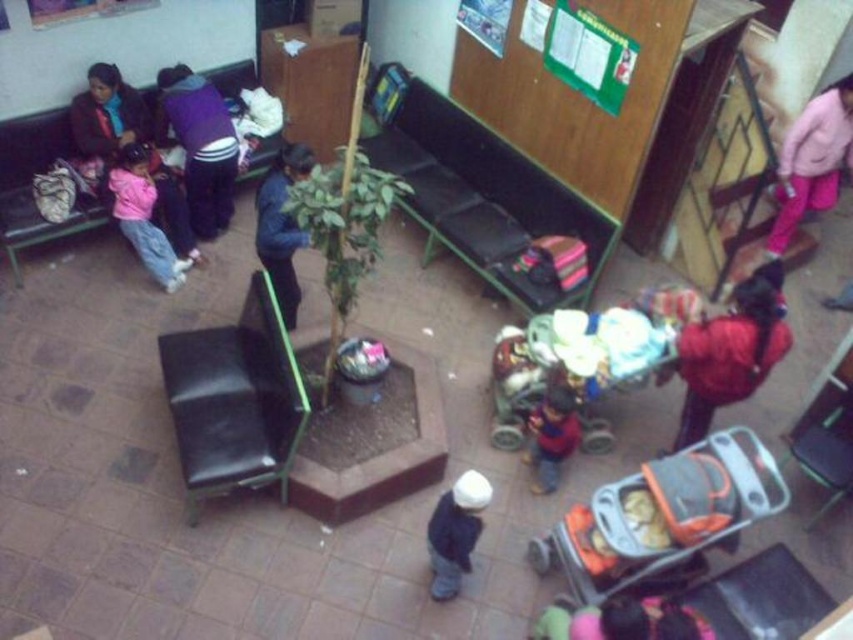
Question: Considering the real-world distances, which object is farthest from the pink fleece jacket at upper right?

Choices:
 (A) dark blue denim jacket at center
 (B) purple fleece jacket at upper left
 (C) fluffy pink blanket at lower center

Answer: (B)

Question: Based on their relative distances, which object is farther from the fluffy pink blanket at lower center?

Choices:
 (A) matte purple sweater at upper left
 (B) purple fleece jacket at upper left
 (C) blue fabric jacket at center

Answer: (A)

Question: Can you confirm if purple fleece jacket at upper left is thinner than fluffy pink blanket at lower center?

Choices:
 (A) no
 (B) yes

Answer: (B)

Question: Which object is farther from the camera taking this photo?

Choices:
 (A) pink fleece jacket at upper left
 (B) green fabric bench at center

Answer: (B)

Question: Is the position of matte purple sweater at upper left more distant than that of fluffy pink blanket at lower center?

Choices:
 (A) yes
 (B) no

Answer: (A)

Question: Is green fabric bench at center thinner than fluffy pink blanket at lower center?

Choices:
 (A) no
 (B) yes

Answer: (A)